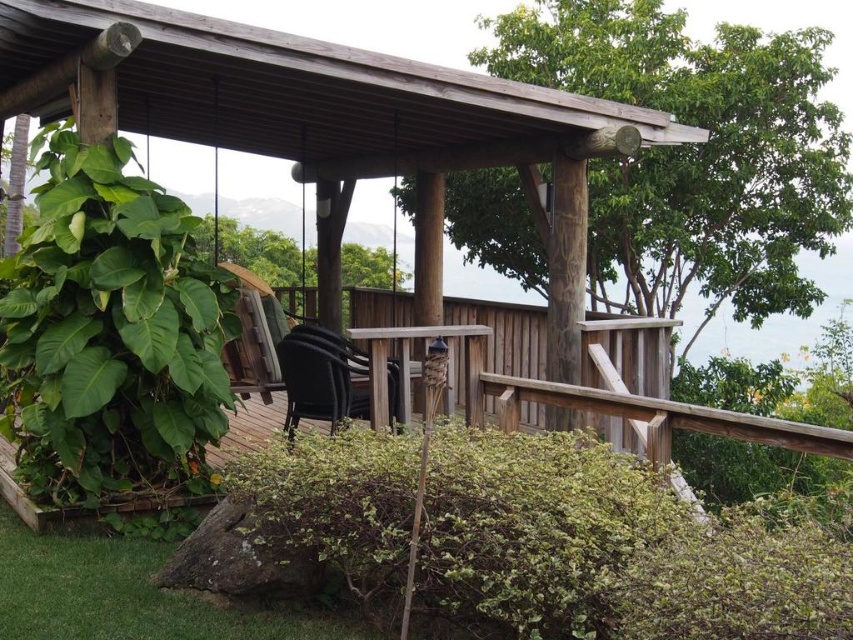
Who is taller, wooden gazebo at center or green leafy tree at center?

wooden gazebo at center

Is wooden gazebo at center further to the viewer compared to green leafy tree at center?

No, wooden gazebo at center is closer to the viewer.

Identify the location of wooden gazebo at center. This screenshot has height=640, width=853. [294, 97].

Between point (119, 467) and point (316, 376), which one is positioned in front?

Point (119, 467) is more forward.

Is green leafy plant at left taller than matte black chair at center?

Indeed, green leafy plant at left has a greater height compared to matte black chair at center.

Is point (42, 381) behind point (387, 401)?

No, it is not.

Where is `green leafy plant at left`? The image size is (853, 640). green leafy plant at left is located at coordinates (111, 337).

Consider the image. Does wooden gazebo at center come in front of matte black chair at center?

No, wooden gazebo at center is further to the viewer.

Is wooden gazebo at center below matte black chair at center?

No.

Who is more forward, [222,97] or [328,348]?

Point [328,348]

I want to click on wooden gazebo at center, so click(x=294, y=97).